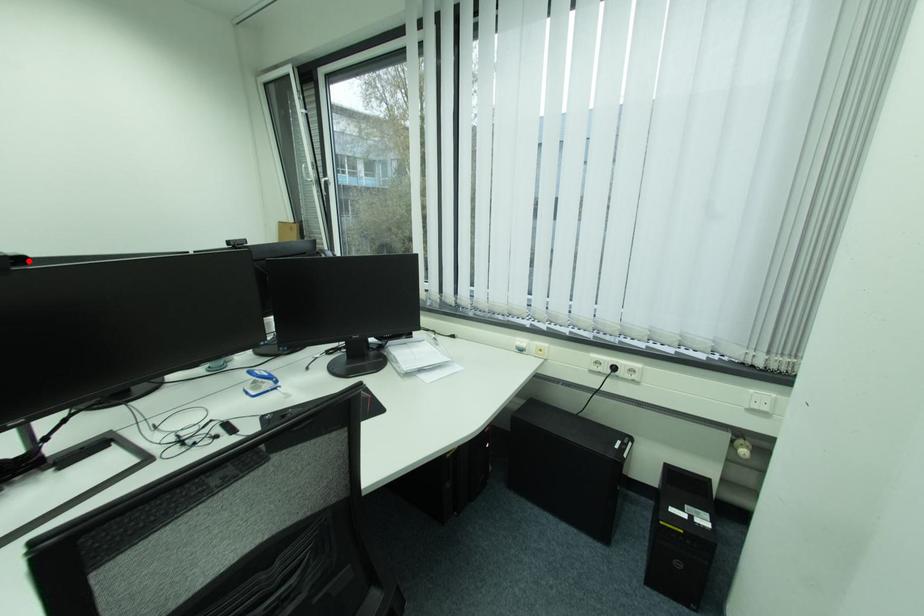
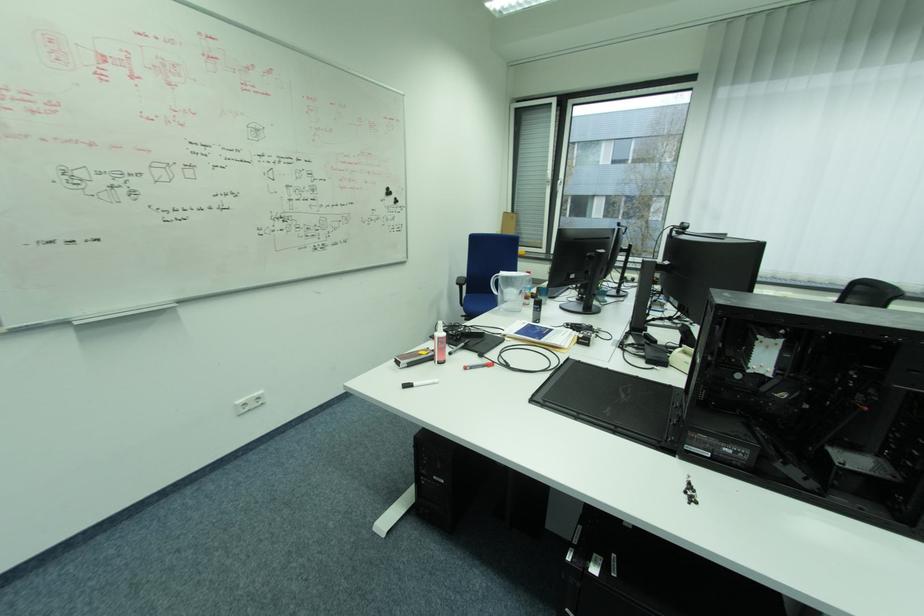
Question: I am providing you with two images of the same scene from different viewpoints. A red point is marked on the first image. Can you still see the location of the red point in image 2?

Choices:
 (A) Yes
 (B) No

Answer: (B)